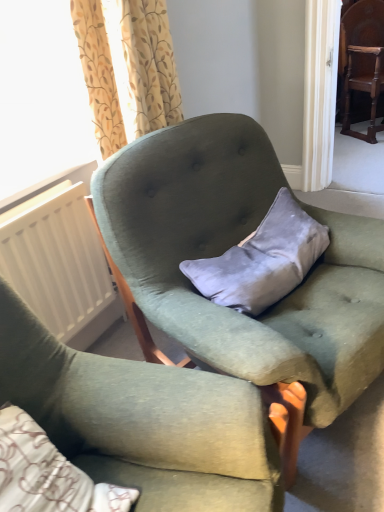
Question: Can we say velvet gray pillow at center lies outside dark brown wood chair at upper right, which is the third chair from left to right?

Choices:
 (A) no
 (B) yes

Answer: (B)

Question: Are velvet gray pillow at center and dark brown wood chair at upper right, which is the third chair from left to right, making contact?

Choices:
 (A) no
 (B) yes

Answer: (A)

Question: Does velvet gray pillow at center have a smaller size compared to dark brown wood chair at upper right, the 1th chair positioned from the right?

Choices:
 (A) no
 (B) yes

Answer: (B)

Question: Does velvet gray pillow at center lie in front of dark brown wood chair at upper right, which appears as the first chair when viewed from the back?

Choices:
 (A) no
 (B) yes

Answer: (B)

Question: Is velvet gray pillow at center thinner than dark brown wood chair at upper right, the 1th chair from the top?

Choices:
 (A) yes
 (B) no

Answer: (A)

Question: Considering the positions of point (309, 323) and point (109, 7), is point (309, 323) closer or farther from the camera than point (109, 7)?

Choices:
 (A) closer
 (B) farther

Answer: (A)

Question: Looking at their shapes, would you say velvet green armchair at center, the 2th chair when ordered from bottom to top, is wider or thinner than floral-patterned fabric curtain at upper left?

Choices:
 (A) wide
 (B) thin

Answer: (A)

Question: Considering the positions of velvet green armchair at center, placed as the second chair when sorted from back to front, and floral-patterned fabric curtain at upper left in the image, is velvet green armchair at center, placed as the second chair when sorted from back to front, taller or shorter than floral-patterned fabric curtain at upper left?

Choices:
 (A) tall
 (B) short

Answer: (A)

Question: From a real-world perspective, relative to floral-patterned fabric curtain at upper left, is velvet green armchair at center, the 2th chair when ordered from bottom to top, vertically above or below?

Choices:
 (A) below
 (B) above

Answer: (A)

Question: From the image's perspective, is dark brown wood chair at upper right, which appears as the first chair when viewed from the back, above or below velvet gray pillow at center?

Choices:
 (A) below
 (B) above

Answer: (B)

Question: Considering their positions, is dark brown wood chair at upper right, which appears as the first chair when viewed from the back, located in front of or behind velvet gray pillow at center?

Choices:
 (A) behind
 (B) front

Answer: (A)

Question: Considering the positions of dark brown wood chair at upper right, which is the third chair from left to right, and velvet gray pillow at center in the image, is dark brown wood chair at upper right, which is the third chair from left to right, wider or thinner than velvet gray pillow at center?

Choices:
 (A) thin
 (B) wide

Answer: (B)

Question: Is point (375, 92) closer or farther from the camera than point (304, 222)?

Choices:
 (A) farther
 (B) closer

Answer: (A)

Question: Considering the relative positions of white plastic radiator at left and dark brown wood chair at upper right, which is the third chair in bottom-to-top order, in the image provided, is white plastic radiator at left to the left or to the right of dark brown wood chair at upper right, which is the third chair in bottom-to-top order,?

Choices:
 (A) right
 (B) left

Answer: (B)

Question: Considering the positions of white plastic radiator at left and dark brown wood chair at upper right, which is the third chair from left to right, in the image, is white plastic radiator at left wider or thinner than dark brown wood chair at upper right, which is the third chair from left to right,?

Choices:
 (A) thin
 (B) wide

Answer: (A)